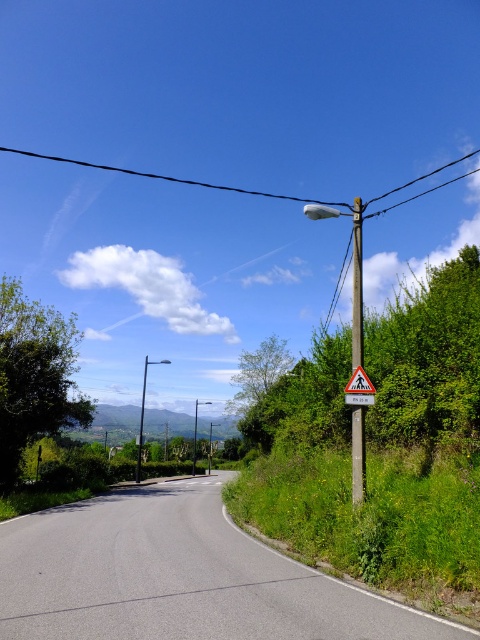
Question: Is metallic gray pole at upper right to the left of yellow plastic pedestrian crossing sign at upper right from the viewer's perspective?

Choices:
 (A) yes
 (B) no

Answer: (B)

Question: Which point appears farthest from the camera in this image?

Choices:
 (A) (357, 374)
 (B) (352, 451)

Answer: (A)

Question: Estimate the real-world distances between objects in this image. Which object is farther from the metallic gray pole at upper right?

Choices:
 (A) yellow plastic pedestrian crossing sign at upper right
 (B) black wire at upper center

Answer: (B)

Question: Which object appears farthest from the camera in this image?

Choices:
 (A) metallic gray pole at upper right
 (B) black wire at upper center
 (C) yellow plastic pedestrian crossing sign at upper right

Answer: (B)

Question: Can you confirm if metallic gray pole at upper right is bigger than yellow plastic pedestrian crossing sign at upper right?

Choices:
 (A) yes
 (B) no

Answer: (A)

Question: Does metallic gray pole at upper right have a lesser width compared to yellow plastic pedestrian crossing sign at upper right?

Choices:
 (A) yes
 (B) no

Answer: (B)